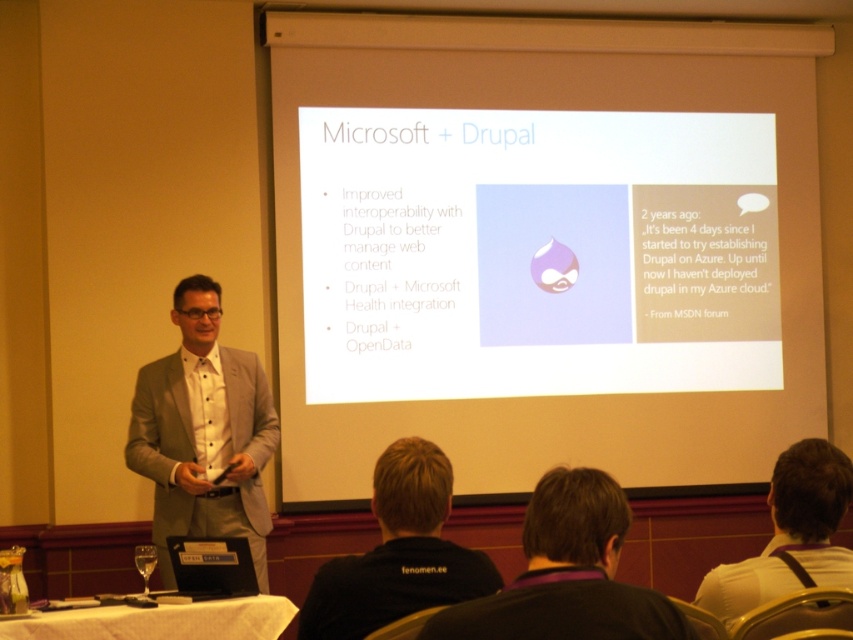
Question: Is light gray suit at left below dark brown hair at center?

Choices:
 (A) no
 (B) yes

Answer: (A)

Question: Which point is farther to the camera?

Choices:
 (A) (325, 621)
 (B) (173, 524)
 (C) (599, 522)
 (D) (746, 564)

Answer: (B)

Question: Which object is positioned closest to the black fabric shirt at lower center?

Choices:
 (A) dark brown hair at center
 (B) light gray suit at left

Answer: (A)

Question: Can you confirm if light gray suit at left is positioned to the left of dark brown hair at center?

Choices:
 (A) no
 (B) yes

Answer: (B)

Question: Can you confirm if dark brown hair at center is thinner than black fabric shirt at lower center?

Choices:
 (A) no
 (B) yes

Answer: (A)

Question: Which object is the closest to the black fabric shirt at lower center?

Choices:
 (A) light gray suit at left
 (B) white fabric shirt at upper center

Answer: (B)